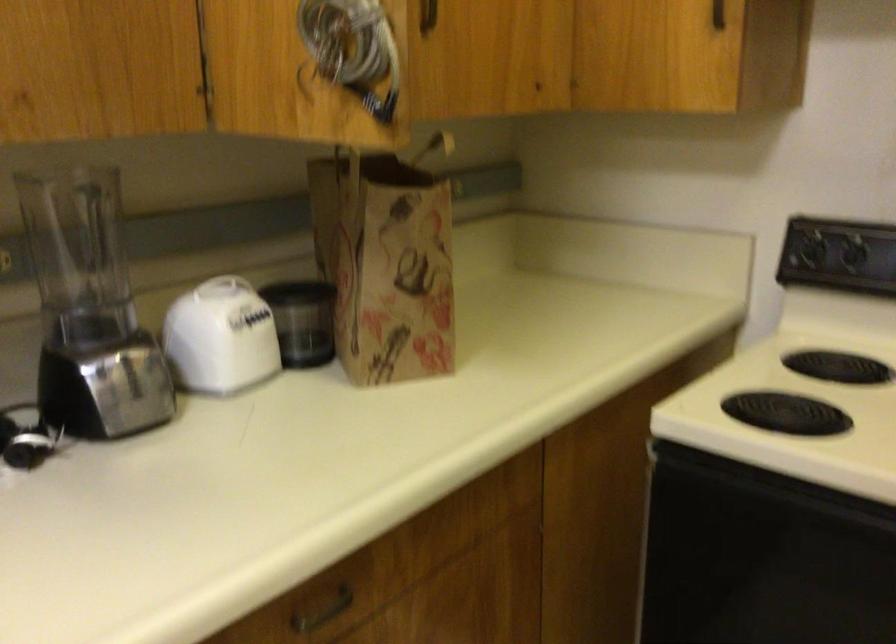
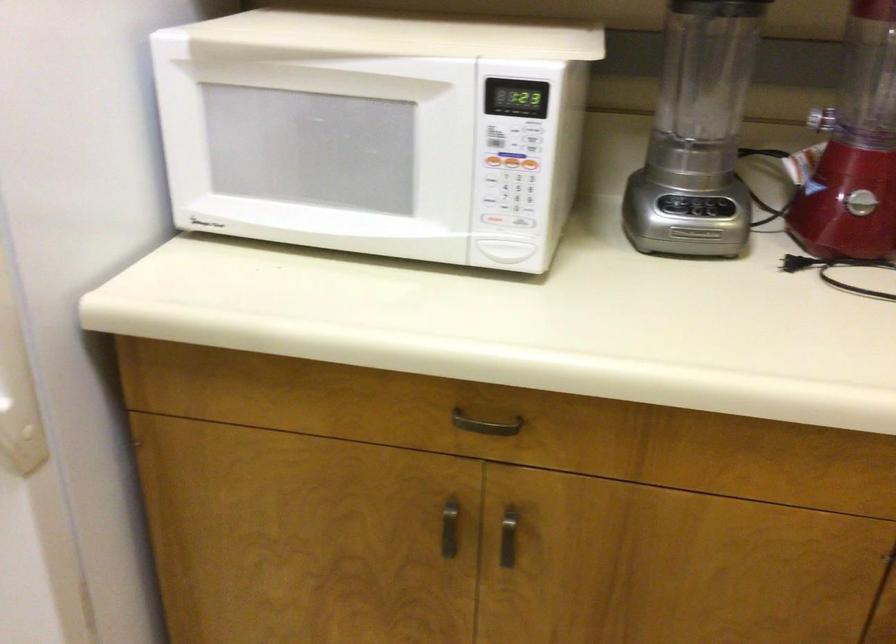
First-person continuous shooting, in which direction is the camera rotating?

The camera's rotation is toward left-down.